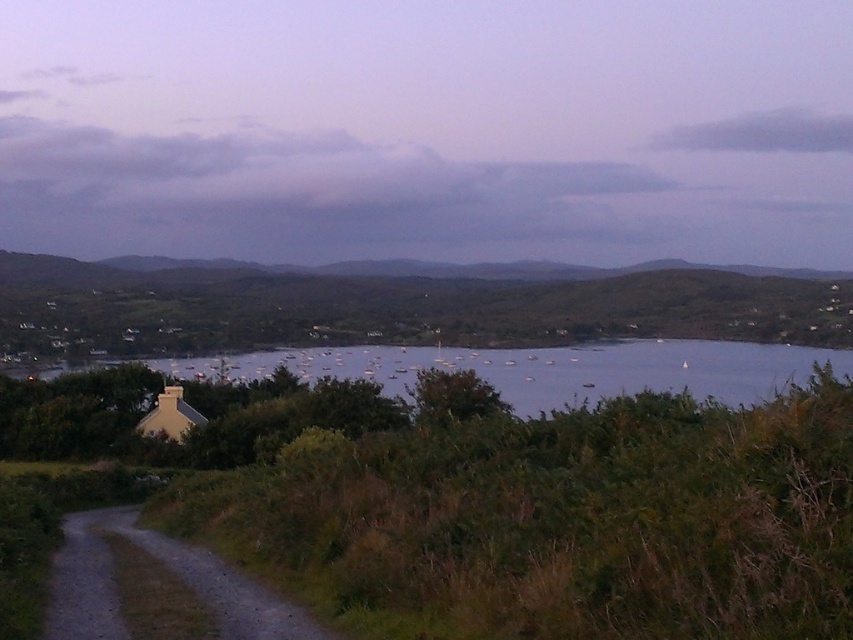
From the picture: Can you confirm if cloudy sky at upper center is taller than clear water at center?

Yes, cloudy sky at upper center is taller than clear water at center.

Between point (641, 244) and point (456, 349), which one is positioned behind?

The point (641, 244) is more distant.

The height and width of the screenshot is (640, 853). Find the location of `cloudy sky at upper center`. cloudy sky at upper center is located at coordinates (428, 129).

Where is `green grassy hillside at center`? This screenshot has height=640, width=853. green grassy hillside at center is located at coordinates (393, 307).

Measure the distance between green grassy hillside at center and camera.

They are 368.40 feet apart.

Between point (343, 317) and point (488, 376), which one is positioned behind?

The point (343, 317) is behind.

At what (x,y) coordinates should I click in order to perform the action: click on green grassy hillside at center. Please return your answer as a coordinate pair (x, y). Looking at the image, I should click on (393, 307).

How much distance is there between clear water at center and dirt/gravel path at lower left?

They are 56.44 meters apart.

Does clear water at center appear on the right side of dirt/gravel path at lower left?

Yes, clear water at center is to the right of dirt/gravel path at lower left.

Is point (515, 397) closer to camera compared to point (209, 577)?

No.

What are the coordinates of `clear water at center` in the screenshot? It's located at [x=546, y=369].